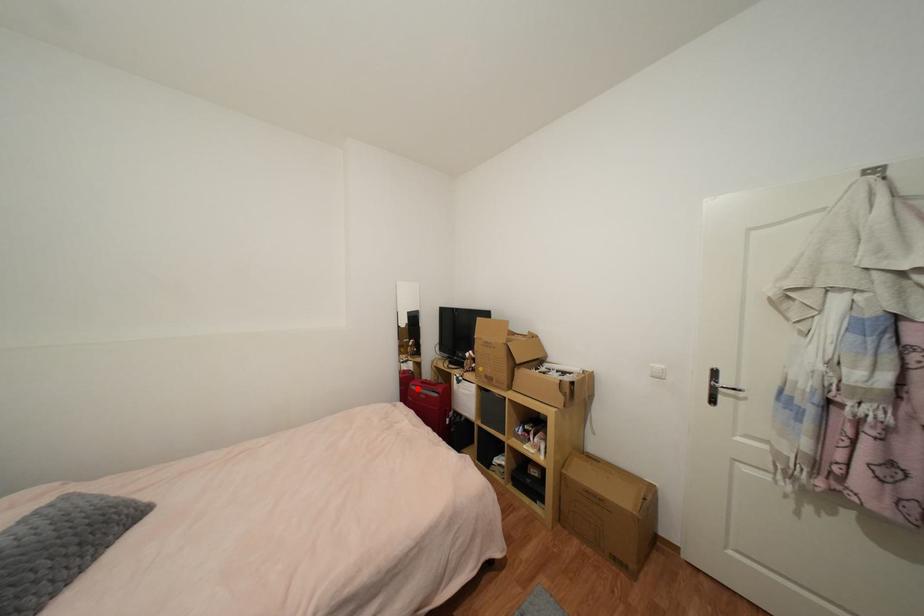
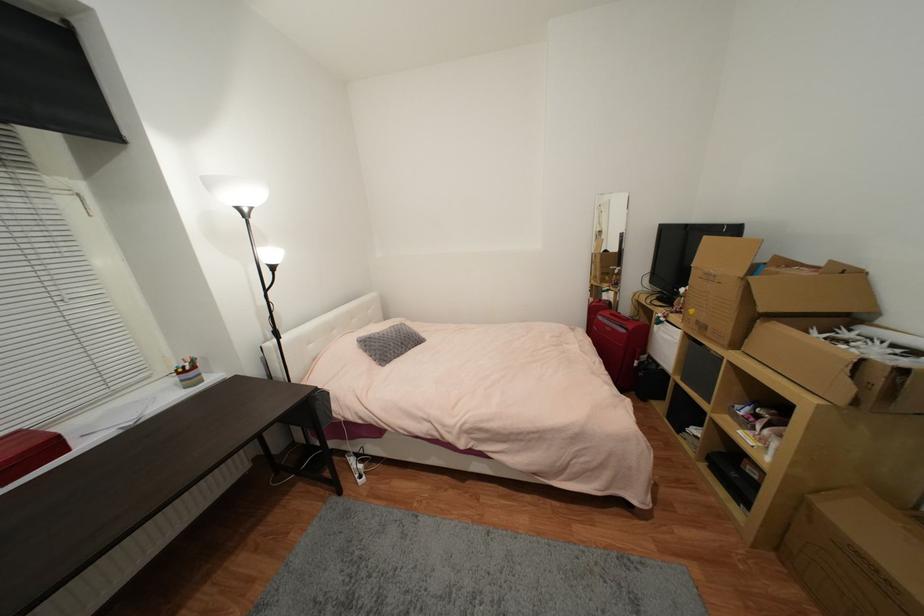
Find the pixel in the second image that matches the highlighted location in the first image.

(603, 318)